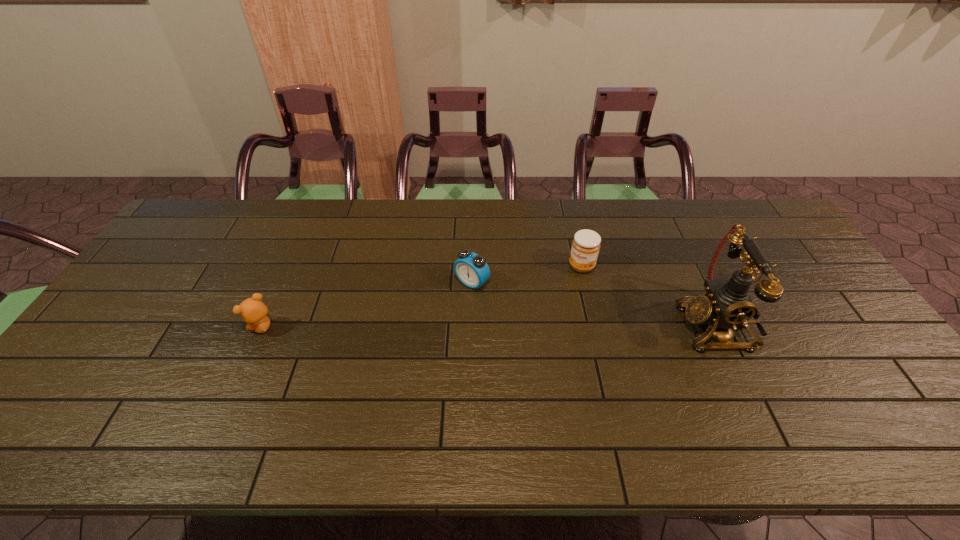
You are a GUI agent. You are given a task and a screenshot of the screen. Output one action in this format:
    pyautogui.click(x=<x>, y=<y>)
    Task: Click on the free space located 0.060m on the front of the telephone, featuring the rotary dial
    The image size is (960, 540).
    Given the screenshot: What is the action you would take?
    pyautogui.click(x=658, y=326)

Where is `vacant space located on the front label of the jam`? This screenshot has width=960, height=540. vacant space located on the front label of the jam is located at coordinates (564, 290).

This screenshot has width=960, height=540. What are the coordinates of `vacant space located on the front label of the jam` in the screenshot? It's located at (561, 294).

Identify the location of free space located 0.070m on the front label of the jam. (565, 288).

Where is `vacant area situated 0.330m on the face of the third object from right to left`? vacant area situated 0.330m on the face of the third object from right to left is located at coordinates (379, 369).

Find the location of a particular element. This screenshot has height=540, width=960. free space located 0.190m on the face of the third object from right to left is located at coordinates (417, 334).

At what (x,y) coordinates should I click in order to perform the action: click on vacant area situated 0.180m on the face of the third object from right to left. Please return your answer as a coordinate pair (x, y). Looking at the image, I should click on (420, 331).

Locate an element on the screen. vacant space at the far edge of the desktop is located at coordinates (492, 241).

In the image, there is a desktop. Where is `vacant space at the near edge`? This screenshot has width=960, height=540. vacant space at the near edge is located at coordinates (651, 395).

Locate an element on the screen. The height and width of the screenshot is (540, 960). free space at the left edge is located at coordinates (113, 363).